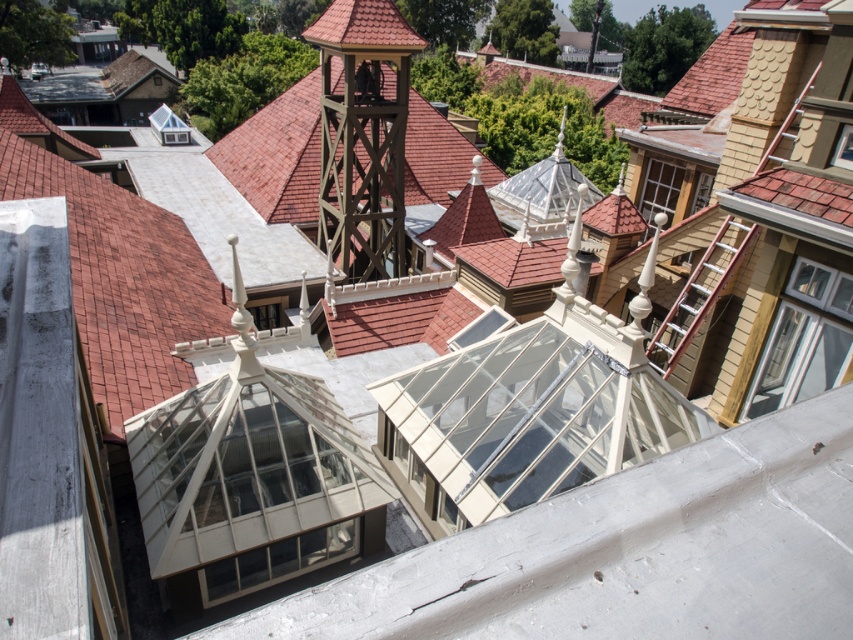
Does wooden bell tower at center appear on the left side of wooden ladder at upper right?

Indeed, wooden bell tower at center is positioned on the left side of wooden ladder at upper right.

Can you confirm if wooden bell tower at center is positioned to the right of wooden ladder at upper right?

No, wooden bell tower at center is not to the right of wooden ladder at upper right.

Does point (364, 243) lie behind point (747, 225)?

Yes, point (364, 243) is behind point (747, 225).

At what (x,y) coordinates should I click in order to perform the action: click on wooden bell tower at center. Please return your answer as a coordinate pair (x, y). Looking at the image, I should click on (363, 134).